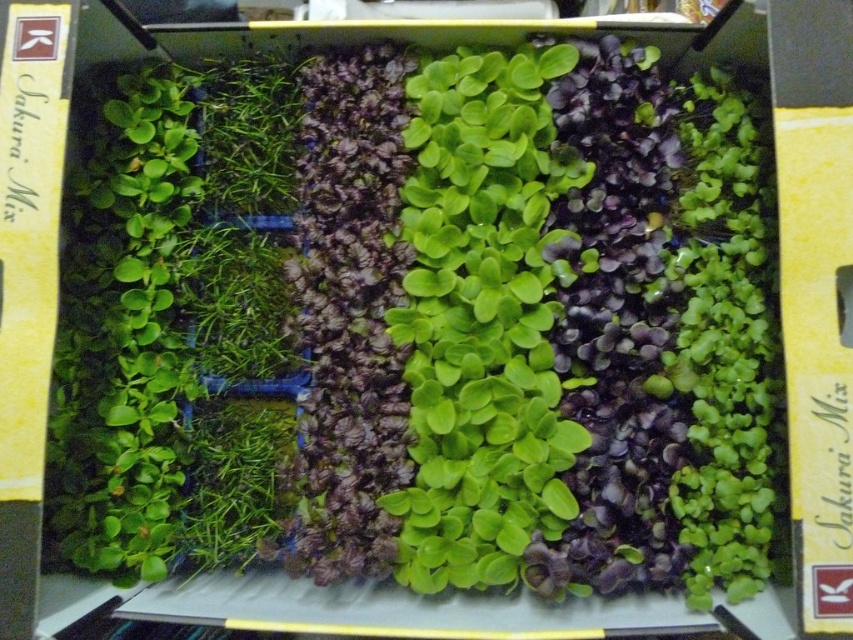
Question: Among these points, which one is nearest to the camera?

Choices:
 (A) (74, 433)
 (B) (514, 540)

Answer: (B)

Question: Estimate the real-world distances between objects in this image. Which object is farther from the green leafy plant at upper left?

Choices:
 (A) green matte leafy plant at left
 (B) green matte leafy plant at right
 (C) green matte leafy plant at center
 (D) green leafy at bottom left

Answer: (B)

Question: In this image, where is green matte leafy plant at center located relative to green leafy at bottom left?

Choices:
 (A) below
 (B) above

Answer: (B)

Question: Which object appears farthest from the camera in this image?

Choices:
 (A) green matte leafy plant at left
 (B) green leafy plant at upper left
 (C) green leafy at bottom left

Answer: (B)

Question: Does green leafy at bottom left appear on the right side of green leafy plant at upper left?

Choices:
 (A) yes
 (B) no

Answer: (B)

Question: Is green matte leafy plant at center to the left of green matte leafy plant at right from the viewer's perspective?

Choices:
 (A) yes
 (B) no

Answer: (A)